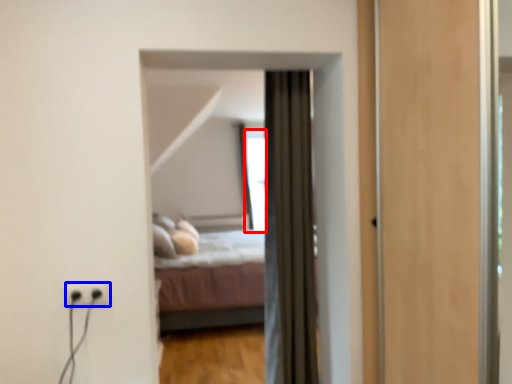
Question: Among these objects, which one is nearest to the camera, window (highlighted by a red box) or electric outlet (highlighted by a blue box)?

Choices:
 (A) window
 (B) electric outlet

Answer: (B)